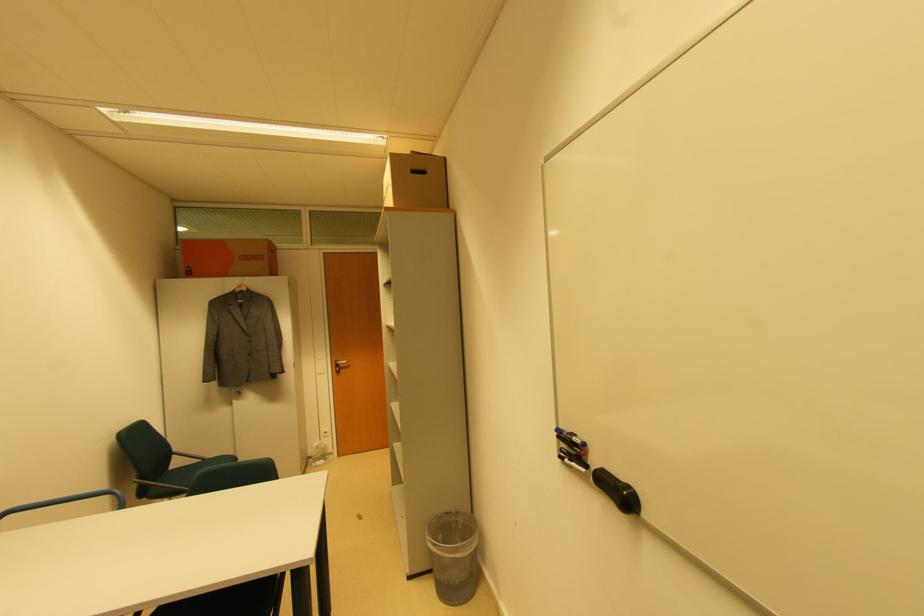
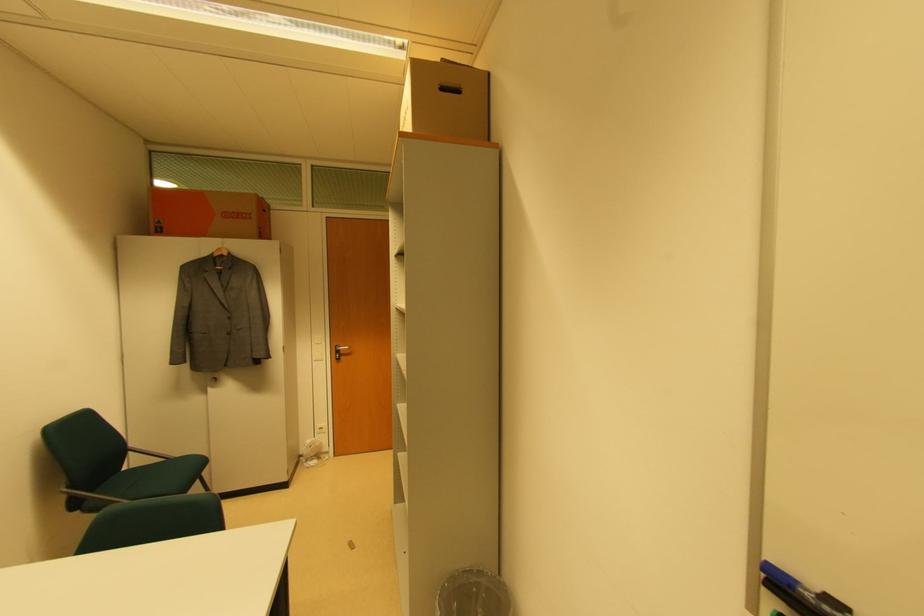
Question: Based on the continuous images, in which direction is the camera rotating? Reply with the corresponding letter.

Choices:
 (A) Left
 (B) Right
 (C) Up
 (D) Down

Answer: (D)